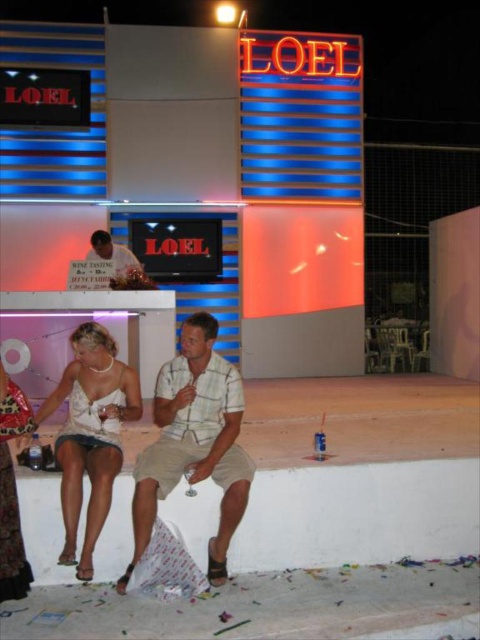
Question: Which object appears closest to the camera in this image?

Choices:
 (A) matte white dress at center
 (B) plaid cotton shirt at center
 (C) plaid shirt at center
 (D) matte white dress at lower left

Answer: (D)

Question: From the image, what is the correct spatial relationship of matte white dress at center in relation to matte white dress at lower left?

Choices:
 (A) right
 (B) left

Answer: (A)

Question: Is matte white dress at center positioned before matte white dress at lower left?

Choices:
 (A) yes
 (B) no

Answer: (B)

Question: Is plaid cotton shirt at center to the right of matte white dress at lower left from the viewer's perspective?

Choices:
 (A) no
 (B) yes

Answer: (B)

Question: Based on their relative distances, which object is nearer to the matte white dress at lower left?

Choices:
 (A) plaid cotton shirt at center
 (B) plaid shirt at center
 (C) matte white dress at center

Answer: (C)

Question: Which of the following is the closest to the observer?

Choices:
 (A) plaid shirt at center
 (B) matte white dress at lower left

Answer: (B)